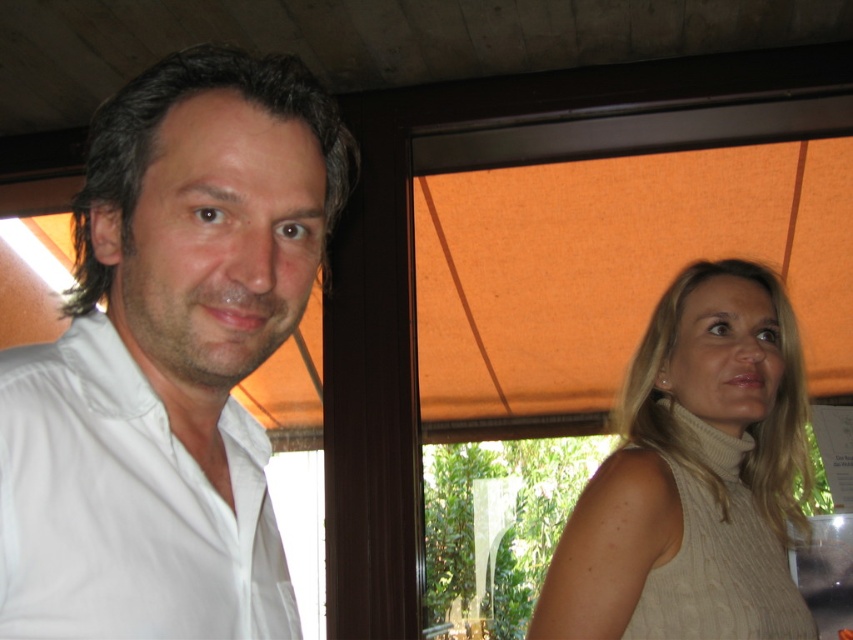
Between white smooth shirt at left and beige knitted sweater at right, which one is positioned higher?

Positioned higher is white smooth shirt at left.

Locate an element on the screen. white smooth shirt at left is located at coordinates tap(169, 358).

The image size is (853, 640). I want to click on white smooth shirt at left, so pyautogui.click(x=169, y=358).

Which of these two, white smooth shirt at left or white cotton shirt at left, stands shorter?

Standing shorter between the two is white cotton shirt at left.

Can you confirm if white smooth shirt at left is taller than white cotton shirt at left?

Yes.

Image resolution: width=853 pixels, height=640 pixels. Find the location of `white smooth shirt at left`. white smooth shirt at left is located at coordinates (169, 358).

Is beige knitted sweater at right taller than white cotton shirt at left?

Correct, beige knitted sweater at right is much taller as white cotton shirt at left.

Measure the distance from beige knitted sweater at right to white cotton shirt at left.

25.37 inches

Who is more forward, (x=792, y=397) or (x=218, y=586)?

Answer: Point (x=218, y=586)

Locate an element on the screen. This screenshot has width=853, height=640. beige knitted sweater at right is located at coordinates (693, 476).